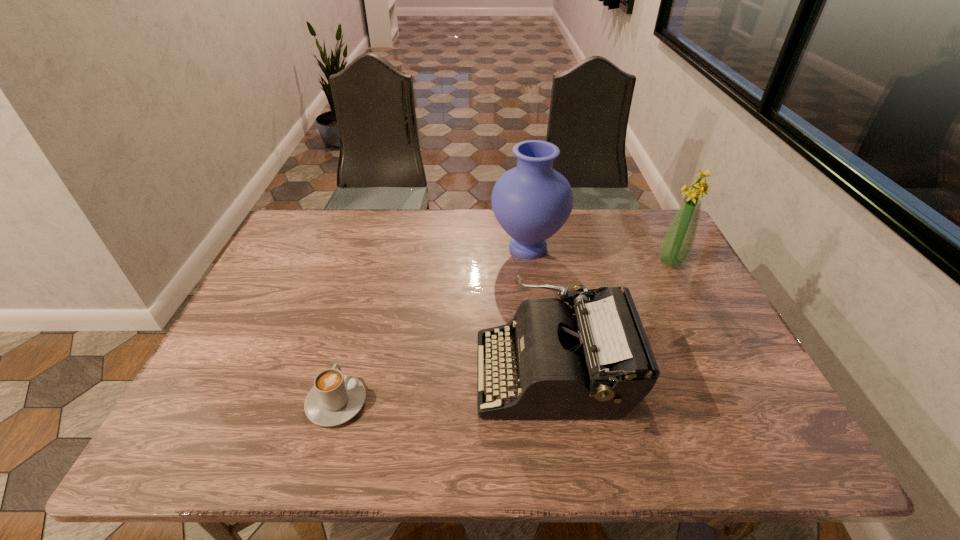
The width and height of the screenshot is (960, 540). What are the coordinates of `vase` in the screenshot? It's located at (531, 202).

The height and width of the screenshot is (540, 960). Identify the location of the rightmost object. (677, 244).

Locate an element on the screen. Image resolution: width=960 pixels, height=540 pixels. typewriter is located at coordinates (594, 360).

The width and height of the screenshot is (960, 540). What are the coordinates of `cappuccino` in the screenshot? It's located at (335, 398).

Where is `the leftmost object`? The width and height of the screenshot is (960, 540). the leftmost object is located at coordinates (335, 398).

I want to click on free spot located on the back of the vase, so click(523, 214).

Image resolution: width=960 pixels, height=540 pixels. Find the location of `vacant space situated 0.370m on the front-facing side of the rightmost object`. vacant space situated 0.370m on the front-facing side of the rightmost object is located at coordinates (533, 262).

Where is `vacant space located 0.070m on the front-facing side of the rightmost object`? vacant space located 0.070m on the front-facing side of the rightmost object is located at coordinates (634, 262).

This screenshot has height=540, width=960. In order to click on vacant space located on the front-facing side of the rightmost object in this screenshot , I will do 620,262.

This screenshot has height=540, width=960. I want to click on free space located 0.300m on the front-facing side of the typewriter, so click(347, 373).